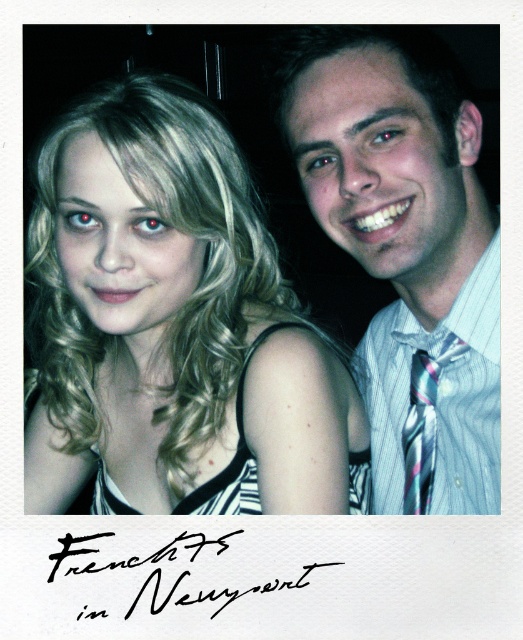
Question: Which point is farther from the camera taking this photo?

Choices:
 (A) (170, 573)
 (B) (406, 330)

Answer: (B)

Question: Which object is positioned closest to the black ink signature at center?

Choices:
 (A) striped shirt at center
 (B) blonde hair at center

Answer: (B)

Question: Does striped shirt at center have a greater width compared to black ink signature at center?

Choices:
 (A) no
 (B) yes

Answer: (A)

Question: Does striped shirt at center appear on the right side of multicolored silk tie at right?

Choices:
 (A) no
 (B) yes

Answer: (A)

Question: Does blonde hair at center have a smaller size compared to black ink signature at center?

Choices:
 (A) yes
 (B) no

Answer: (B)

Question: Among these objects, which one is farthest from the camera?

Choices:
 (A) striped shirt at center
 (B) blonde hair at center
 (C) black ink signature at center

Answer: (B)